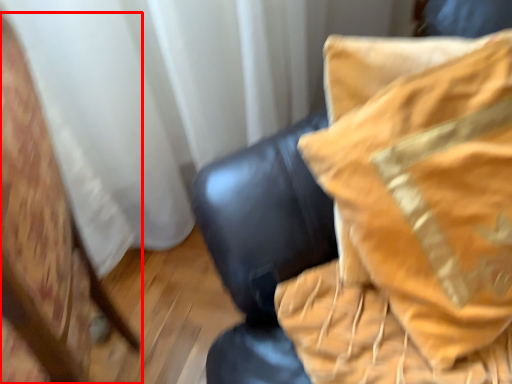
Question: In this image, where is furniture (annotated by the red box) located relative to furniture?

Choices:
 (A) left
 (B) right

Answer: (A)